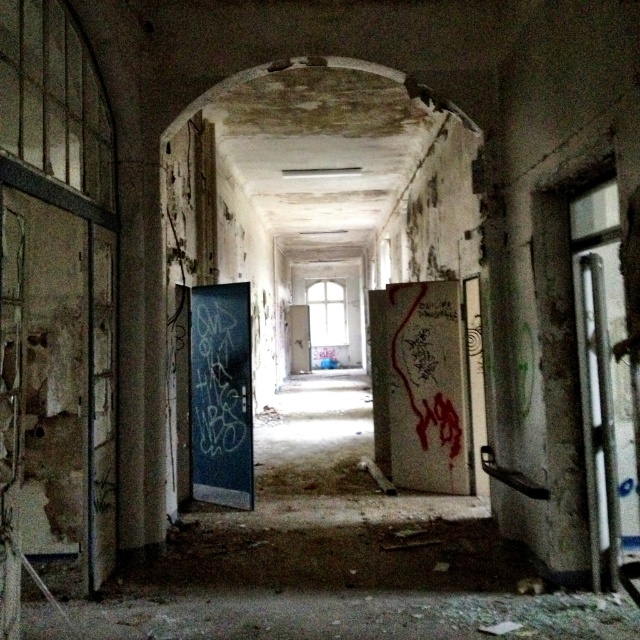
Question: Which object appears closest to the camera in this image?

Choices:
 (A) white matte door at center
 (B) dark blue painted door at center

Answer: (B)

Question: Can you confirm if dark blue painted door at center is bigger than white matte door at center?

Choices:
 (A) yes
 (B) no

Answer: (B)

Question: Which object is farther from the camera taking this photo?

Choices:
 (A) dark blue painted door at center
 (B) white matte door at center

Answer: (B)

Question: Is dark blue painted door at center positioned at the back of white matte door at center?

Choices:
 (A) no
 (B) yes

Answer: (A)

Question: Which point appears farthest from the camera in this image?

Choices:
 (A) (228, 481)
 (B) (305, 342)

Answer: (B)

Question: Where is dark blue painted door at center located in relation to white matte door at center in the image?

Choices:
 (A) above
 (B) below

Answer: (A)